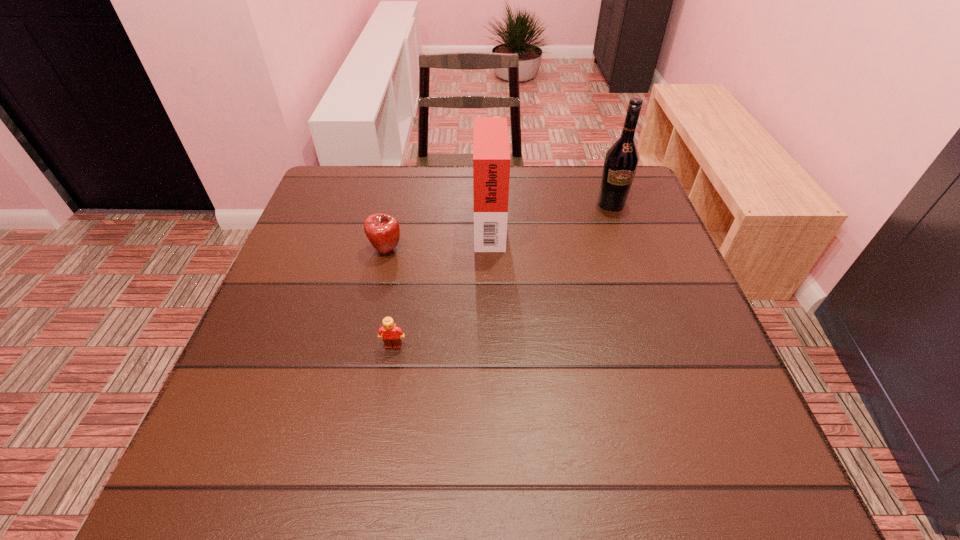
The image size is (960, 540). What are the coordinates of `the closest object relative to the third tallest object` in the screenshot? It's located at (491, 154).

At what (x,y) coordinates should I click in order to perform the action: click on vacant point that satisfies the following two spatial constraints: 1. on the front-facing side of the third object from left to right; 2. on the face of the nearest object. Please return your answer as a coordinate pair (x, y). This screenshot has width=960, height=540. Looking at the image, I should click on (492, 346).

Find the location of a particular element. vacant space that satisfies the following two spatial constraints: 1. on the label of the wine bottle; 2. on the front-facing side of the second object from right to left is located at coordinates (617, 222).

Where is `blank space that satisfies the following two spatial constraints: 1. on the label of the wine bottle; 2. on the front-facing side of the third object from left to right`? This screenshot has height=540, width=960. blank space that satisfies the following two spatial constraints: 1. on the label of the wine bottle; 2. on the front-facing side of the third object from left to right is located at coordinates (617, 222).

Where is `vacant space that satisfies the following two spatial constraints: 1. on the front-facing side of the second object from right to left; 2. on the front side of the third tallest object`? Image resolution: width=960 pixels, height=540 pixels. vacant space that satisfies the following two spatial constraints: 1. on the front-facing side of the second object from right to left; 2. on the front side of the third tallest object is located at coordinates (490, 251).